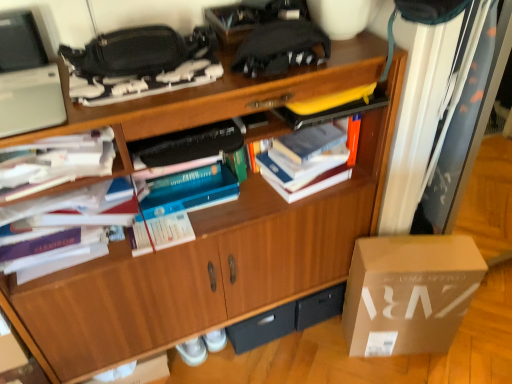
This screenshot has width=512, height=384. What are the coordinates of `free space above silver matte laptop at upper left (from a real-world perspective)` in the screenshot? It's located at (27, 97).